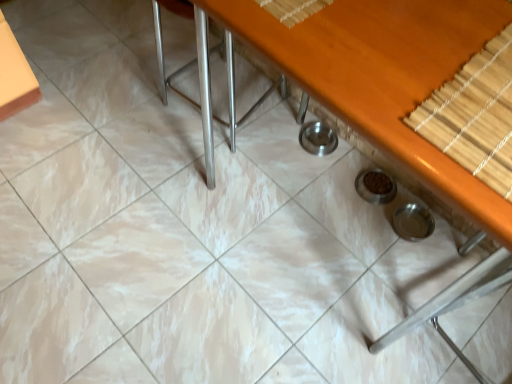
Question: Is wooden table at center far from bamboo mat at upper right?

Choices:
 (A) no
 (B) yes

Answer: (A)

Question: Could you tell me if wooden table at center is facing bamboo mat at upper right?

Choices:
 (A) no
 (B) yes

Answer: (A)

Question: From a real-world perspective, is wooden table at center positioned under bamboo mat at upper right based on gravity?

Choices:
 (A) yes
 (B) no

Answer: (A)

Question: Is wooden table at center shorter than bamboo mat at upper right?

Choices:
 (A) no
 (B) yes

Answer: (A)

Question: Is wooden table at center at the right side of bamboo mat at upper right?

Choices:
 (A) yes
 (B) no

Answer: (B)

Question: From the image's perspective, is wooden table at center over bamboo mat at upper right?

Choices:
 (A) no
 (B) yes

Answer: (B)

Question: From a real-world perspective, is bamboo mat at upper right positioned over wooden table at center based on gravity?

Choices:
 (A) no
 (B) yes

Answer: (B)

Question: Does bamboo mat at upper right have a smaller size compared to wooden table at center?

Choices:
 (A) no
 (B) yes

Answer: (B)

Question: Is bamboo mat at upper right next to wooden table at center and touching it?

Choices:
 (A) yes
 (B) no

Answer: (A)

Question: Is bamboo mat at upper right not inside wooden table at center?

Choices:
 (A) yes
 (B) no

Answer: (B)

Question: Does bamboo mat at upper right appear on the right side of wooden table at center?

Choices:
 (A) no
 (B) yes

Answer: (B)

Question: Is bamboo mat at upper right far from wooden table at center?

Choices:
 (A) no
 (B) yes

Answer: (A)

Question: Is bamboo mat at upper right completely or partially outside of satin silver chair at center?

Choices:
 (A) no
 (B) yes

Answer: (B)